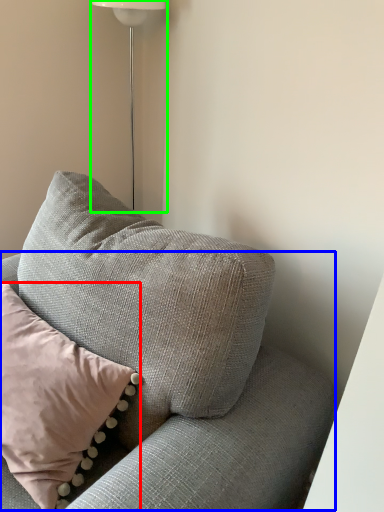
Question: Which object is the closest to the pillow (highlighted by a red box)? Choose among these: couch (highlighted by a blue box) or lamp (highlighted by a green box).

Choices:
 (A) couch
 (B) lamp

Answer: (A)